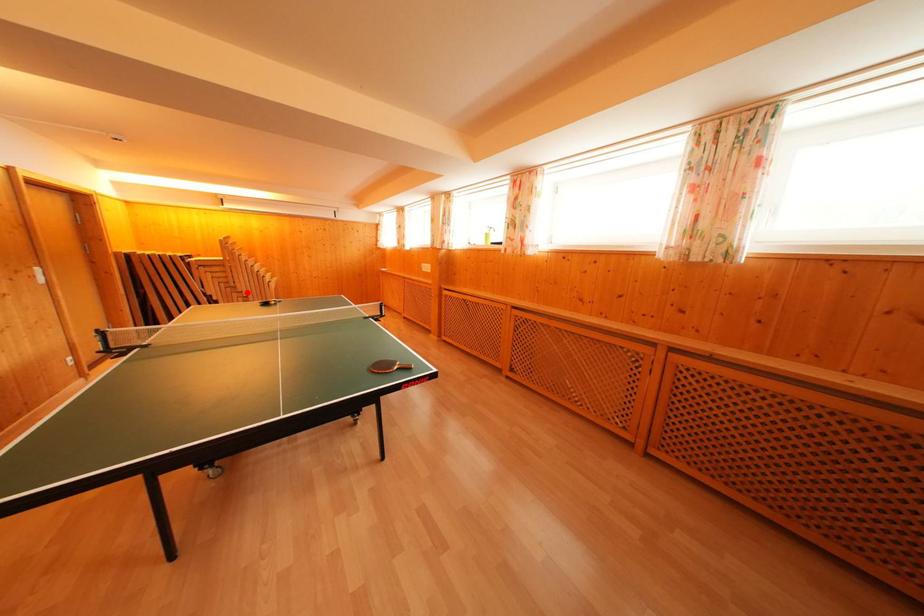
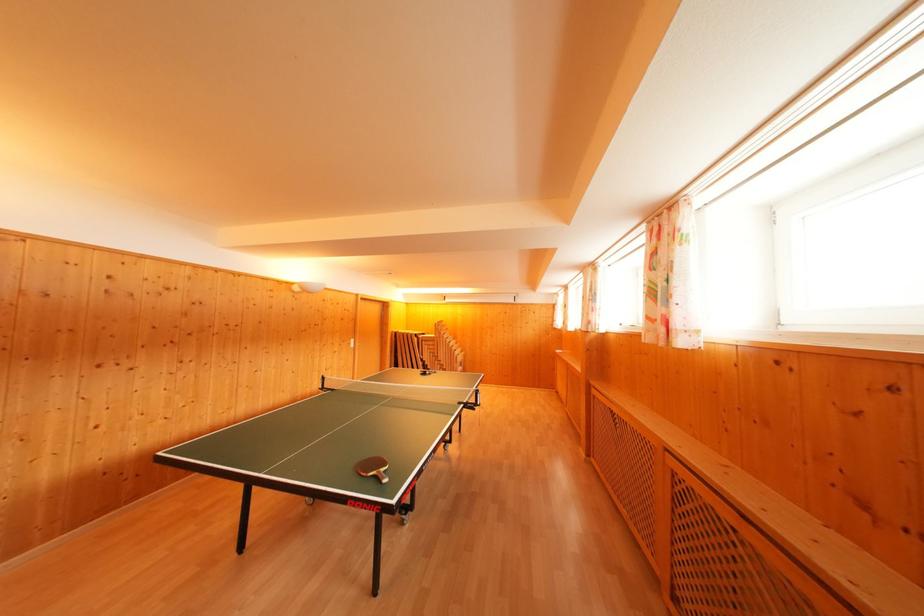
Find the pixel in the second image that matches the highlighted location in the first image.

(445, 362)